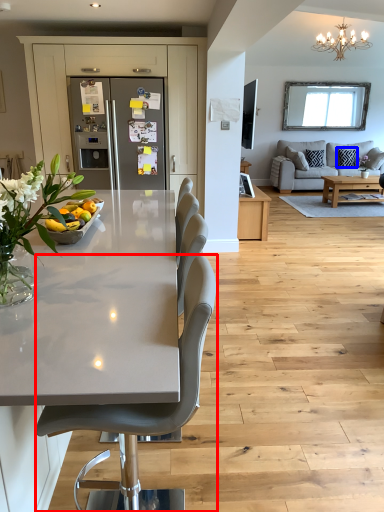
Question: Among these objects, which one is nearest to the camera, chair (highlighted by a red box) or pillow (highlighted by a blue box)?

Choices:
 (A) chair
 (B) pillow

Answer: (A)